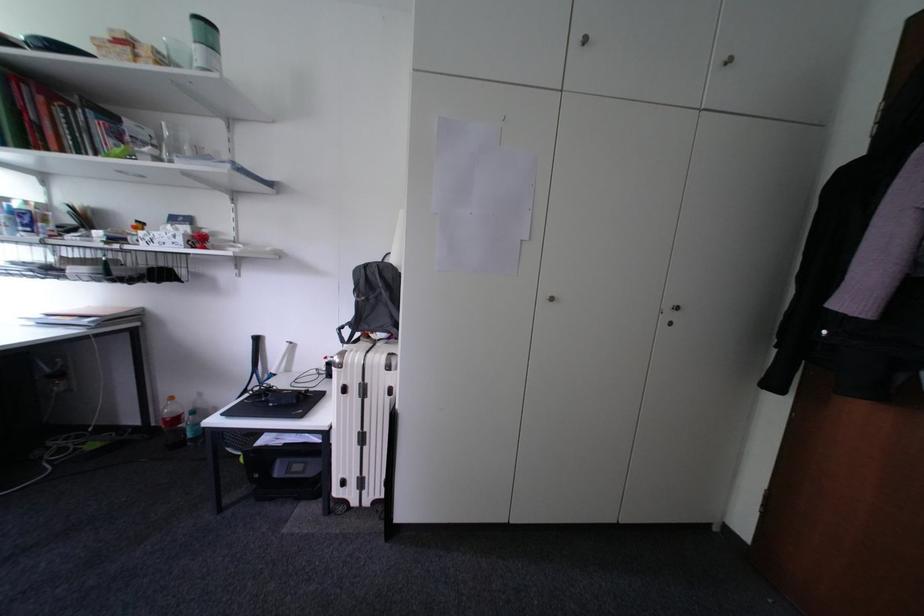
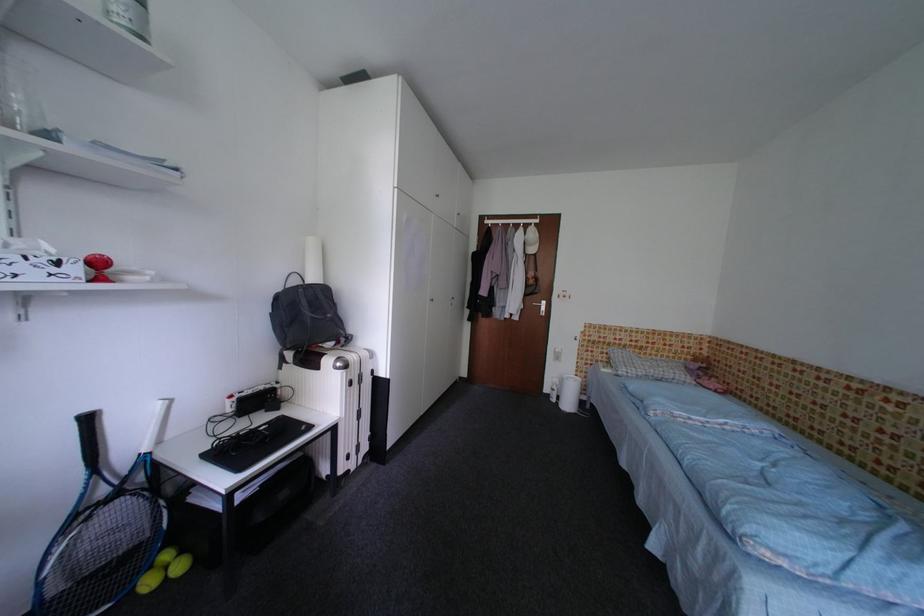
The point at (353, 392) is marked in the first image. Where is the corresponding point in the second image?

(359, 386)